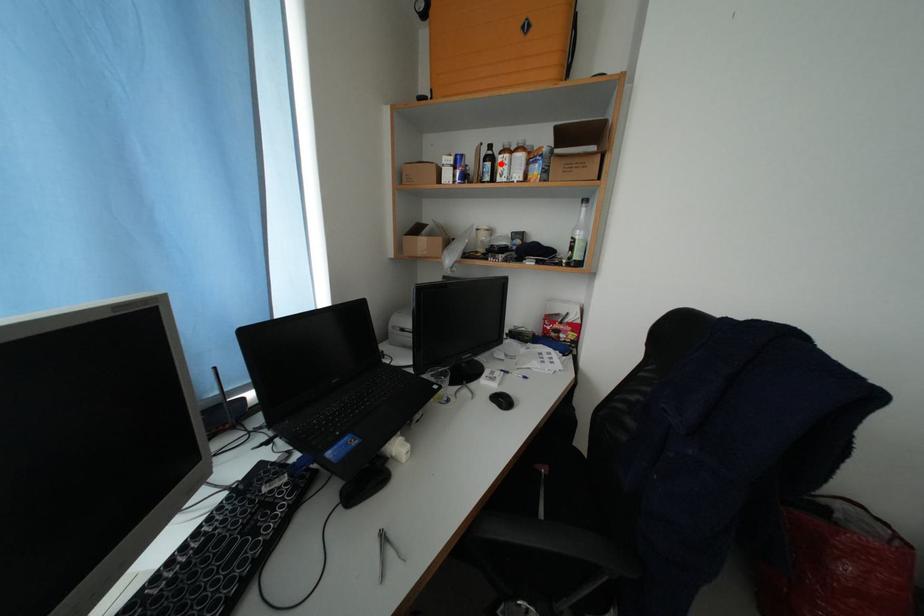
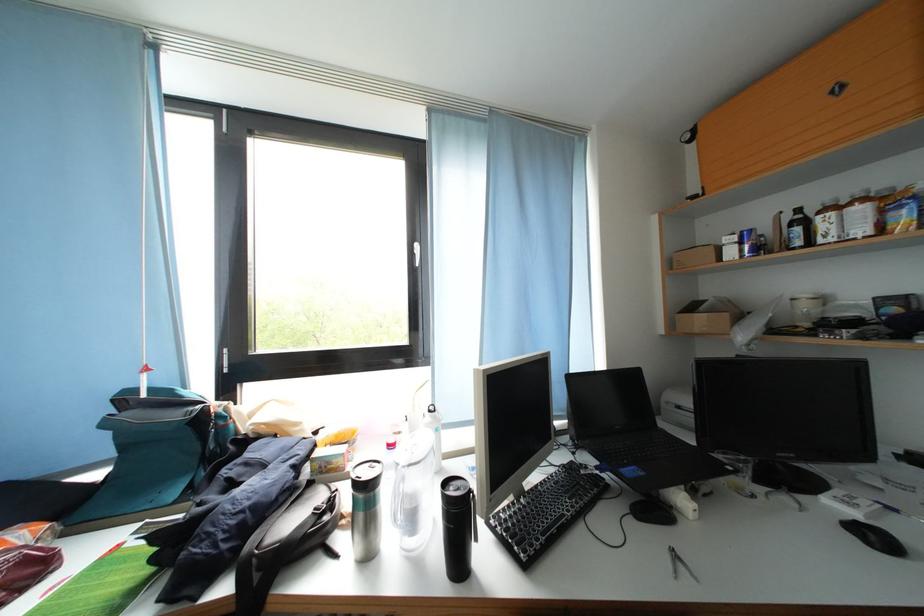
In the second image, find the point that corresponds to the highlighted location in the first image.

(812, 227)